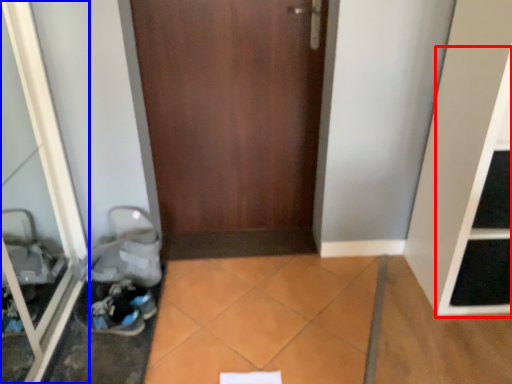
Question: Which object appears closest to the camera in this image, shelf (highlighted by a red box) or glass door (highlighted by a blue box)?

Choices:
 (A) shelf
 (B) glass door

Answer: (B)